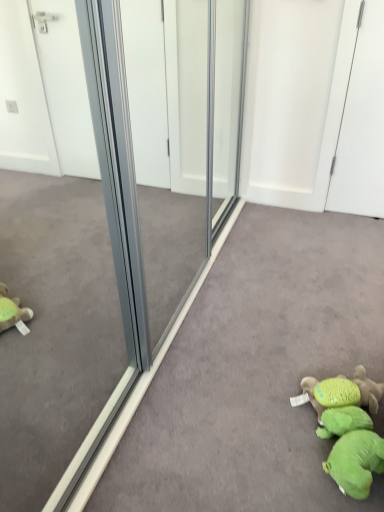
This screenshot has height=512, width=384. What do you see at coordinates (346, 391) in the screenshot?
I see `green plush toy at lower right, which is counted as the 1th toy, starting from the back` at bounding box center [346, 391].

What is the approximate width of green plush toy at lower right, marked as the 1th toy in a front-to-back arrangement?

It is 9.03 inches.

Identify the location of green plush toy at lower right, the second toy positioned from the front. The width and height of the screenshot is (384, 512). tap(346, 391).

Is point (327, 468) closer or farther from the camera than point (314, 389)?

Point (327, 468) appears to be closer to the viewer than point (314, 389).

Does green plush toy at lower right, the 2th toy viewed from the back, have a lesser width compared to green plush toy at lower right, which is counted as the 1th toy, starting from the back?

Yes.

From the picture: Are green plush toy at lower right, marked as the 1th toy in a front-to-back arrangement, and green plush toy at lower right, the second toy positioned from the front, far apart?

No, there isn't a large distance between green plush toy at lower right, marked as the 1th toy in a front-to-back arrangement, and green plush toy at lower right, the second toy positioned from the front.

You are a GUI agent. You are given a task and a screenshot of the screen. Output one action in this format:
    pyautogui.click(x=<x>, y=<y>)
    Task: Click on the toy behind the green plush toy at lower right, marked as the 1th toy in a front-to-back arrangement
    This screenshot has height=512, width=384.
    Given the screenshot: What is the action you would take?
    pyautogui.click(x=346, y=391)

From a real-world perspective, is green plush toy at lower right, which is counted as the 1th toy, starting from the back, positioned above or below clear glass door at center?

green plush toy at lower right, which is counted as the 1th toy, starting from the back, is below clear glass door at center.

Considering the relative positions of green plush toy at lower right, the second toy positioned from the front, and clear glass door at center in the image provided, is green plush toy at lower right, the second toy positioned from the front, to the left or to the right of clear glass door at center?

In the image, green plush toy at lower right, the second toy positioned from the front, appears on the right side of clear glass door at center.

From the image's perspective, count 1st toys downward from the clear glass door at center and point to it. Please provide its 2D coordinates.

[(346, 391)]

Does green plush toy at lower right, the 2th toy viewed from the back, have a smaller size compared to clear glass door at center?

Correct, green plush toy at lower right, the 2th toy viewed from the back, occupies less space than clear glass door at center.

Is green plush toy at lower right, marked as the 1th toy in a front-to-back arrangement, located outside clear glass door at center?

Indeed, green plush toy at lower right, marked as the 1th toy in a front-to-back arrangement, is completely outside clear glass door at center.

Is the position of green plush toy at lower right, marked as the 1th toy in a front-to-back arrangement, more distant than that of clear glass door at center?

Yes, it is.

From the image's perspective, is green plush toy at lower right, the 2th toy viewed from the back, located above or below clear glass door at center?

green plush toy at lower right, the 2th toy viewed from the back, is situated lower than clear glass door at center in the image.

At what (x,y) coordinates should I click in order to perform the action: click on toy that is the 2nd one when counting forward from the white glossy screen door at upper right. Please return your answer as a coordinate pair (x, y). Looking at the image, I should click on (349, 429).

Which is more to the right, green plush toy at lower right, the 2th toy viewed from the back, or white glossy screen door at upper right?

white glossy screen door at upper right.

From a real-world perspective, is green plush toy at lower right, marked as the 1th toy in a front-to-back arrangement, on white glossy screen door at upper right?

Incorrect, from a real-world perspective, green plush toy at lower right, marked as the 1th toy in a front-to-back arrangement, is lower than white glossy screen door at upper right.

Considering the relative sizes of green plush toy at lower right, marked as the 1th toy in a front-to-back arrangement, and white glossy screen door at upper right in the image provided, is green plush toy at lower right, marked as the 1th toy in a front-to-back arrangement, taller than white glossy screen door at upper right?

In fact, green plush toy at lower right, marked as the 1th toy in a front-to-back arrangement, may be shorter than white glossy screen door at upper right.

Is white glossy screen door at upper right wider or thinner than green plush toy at lower right, the second toy positioned from the front?

In the image, white glossy screen door at upper right appears to be more narrow than green plush toy at lower right, the second toy positioned from the front.

Considering the sizes of objects white glossy screen door at upper right and green plush toy at lower right, which is counted as the 1th toy, starting from the back, in the image provided, who is taller, white glossy screen door at upper right or green plush toy at lower right, which is counted as the 1th toy, starting from the back,?

white glossy screen door at upper right.

Could you tell me if white glossy screen door at upper right is facing green plush toy at lower right, the second toy positioned from the front?

Yes, white glossy screen door at upper right is aimed at green plush toy at lower right, the second toy positioned from the front.

Is white glossy screen door at upper right closer to camera compared to green plush toy at lower right, which is counted as the 1th toy, starting from the back?

No.

Is clear glass door at center smaller than white glossy screen door at upper right?

No.

From a real-world perspective, is clear glass door at center positioned above or below white glossy screen door at upper right?

clear glass door at center is situated higher than white glossy screen door at upper right in the real world.

Considering the positions of objects clear glass door at center and white glossy screen door at upper right in the image provided, who is more to the right, clear glass door at center or white glossy screen door at upper right?

Positioned to the right is white glossy screen door at upper right.

Which of these two, green plush toy at lower right, the second toy positioned from the front, or green plush toy at lower right, marked as the 1th toy in a front-to-back arrangement, stands taller?

green plush toy at lower right, the second toy positioned from the front.

Does green plush toy at lower right, the second toy positioned from the front, have a smaller size compared to green plush toy at lower right, the 2th toy viewed from the back?

Indeed, green plush toy at lower right, the second toy positioned from the front, has a smaller size compared to green plush toy at lower right, the 2th toy viewed from the back.

Which object is further away from the camera, green plush toy at lower right, the second toy positioned from the front, or green plush toy at lower right, marked as the 1th toy in a front-to-back arrangement?

green plush toy at lower right, the second toy positioned from the front, is behind.

In the image, there is a green plush toy at lower right, the second toy positioned from the front. Where is `toy below it (from a real-world perspective)`? The image size is (384, 512). toy below it (from a real-world perspective) is located at coordinates (349, 429).

From the image's perspective, count 1st toys downward from the clear glass door at center and point to it. Please provide its 2D coordinates.

[(346, 391)]

Estimate the real-world distances between objects in this image. Which object is further from green plush toy at lower right, the 2th toy viewed from the back, white glossy screen door at upper right or green plush toy at lower right, which is counted as the 1th toy, starting from the back?

white glossy screen door at upper right is positioned further to the anchor green plush toy at lower right, the 2th toy viewed from the back.

Looking at the image, which one is located further to clear glass door at center, green plush toy at lower right, the 2th toy viewed from the back, or green plush toy at lower right, which is counted as the 1th toy, starting from the back?

The object further to clear glass door at center is green plush toy at lower right, which is counted as the 1th toy, starting from the back.

Which object lies nearer to the anchor point green plush toy at lower right, the 2th toy viewed from the back, clear glass door at center or green plush toy at lower right, the second toy positioned from the front?

green plush toy at lower right, the second toy positioned from the front.

Based on their spatial positions, is clear glass door at center or green plush toy at lower right, marked as the 1th toy in a front-to-back arrangement, further from green plush toy at lower right, the second toy positioned from the front?

Among the two, clear glass door at center is located further to green plush toy at lower right, the second toy positioned from the front.

Based on the photo, which object lies nearer to the anchor point green plush toy at lower right, marked as the 1th toy in a front-to-back arrangement, clear glass door at center or white glossy screen door at upper right?

Based on the image, clear glass door at center appears to be nearer to green plush toy at lower right, marked as the 1th toy in a front-to-back arrangement.

Which object lies further to the anchor point green plush toy at lower right, the 2th toy viewed from the back, white glossy screen door at upper right or clear glass door at center?

Among the two, white glossy screen door at upper right is located further to green plush toy at lower right, the 2th toy viewed from the back.

Estimate the real-world distances between objects in this image. Which object is further from green plush toy at lower right, which is counted as the 1th toy, starting from the back, green plush toy at lower right, marked as the 1th toy in a front-to-back arrangement, or clear glass door at center?

clear glass door at center.

When comparing their distances from white glossy screen door at upper right, does green plush toy at lower right, the second toy positioned from the front, or clear glass door at center seem closer?

green plush toy at lower right, the second toy positioned from the front, is closer to white glossy screen door at upper right.

Find the location of a particular element. toy between white glossy screen door at upper right and green plush toy at lower right, the 2th toy viewed from the back, in the up-down direction is located at coordinates [346, 391].

Identify the location of toy between clear glass door at center and green plush toy at lower right, the second toy positioned from the front, from front to back. The width and height of the screenshot is (384, 512). (349, 429).